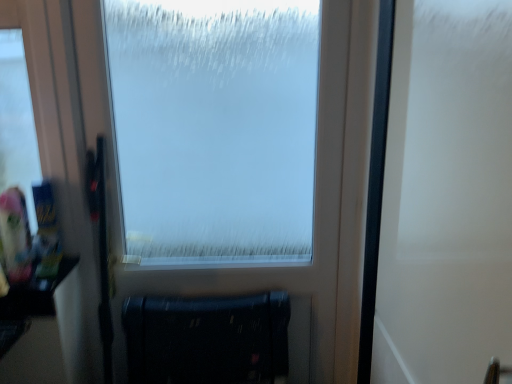
Question: Can you confirm if matte black radiator at lower center is taller than white matte screen door at right?

Choices:
 (A) yes
 (B) no

Answer: (B)

Question: Is matte black radiator at lower center completely or partially outside of white matte screen door at right?

Choices:
 (A) yes
 (B) no

Answer: (A)

Question: Considering the relative sizes of matte black radiator at lower center and white matte screen door at right in the image provided, is matte black radiator at lower center bigger than white matte screen door at right?

Choices:
 (A) no
 (B) yes

Answer: (A)

Question: Considering the relative sizes of matte black radiator at lower center and white matte screen door at right in the image provided, is matte black radiator at lower center smaller than white matte screen door at right?

Choices:
 (A) no
 (B) yes

Answer: (B)

Question: Is white matte screen door at right at the back of matte black radiator at lower center?

Choices:
 (A) no
 (B) yes

Answer: (A)

Question: From a real-world perspective, is white matte screen door at right above or below frosted glass window at center?

Choices:
 (A) below
 (B) above

Answer: (B)

Question: Is white matte screen door at right spatially inside frosted glass window at center, or outside of it?

Choices:
 (A) inside
 (B) outside

Answer: (B)

Question: Looking at their shapes, would you say white matte screen door at right is wider or thinner than frosted glass window at center?

Choices:
 (A) thin
 (B) wide

Answer: (B)

Question: Considering the positions of point (426, 29) and point (361, 97), is point (426, 29) closer or farther from the camera than point (361, 97)?

Choices:
 (A) farther
 (B) closer

Answer: (B)

Question: From their relative heights in the image, would you say matte black radiator at lower center is taller or shorter than frosted glass window at center?

Choices:
 (A) tall
 (B) short

Answer: (B)

Question: Looking at their shapes, would you say matte black radiator at lower center is wider or thinner than frosted glass window at center?

Choices:
 (A) wide
 (B) thin

Answer: (A)

Question: In terms of size, does matte black radiator at lower center appear bigger or smaller than frosted glass window at center?

Choices:
 (A) small
 (B) big

Answer: (A)

Question: From a real-world perspective, relative to frosted glass window at center, is matte black radiator at lower center vertically above or below?

Choices:
 (A) above
 (B) below

Answer: (B)

Question: From a real-world perspective, relative to white matte screen door at right, is frosted glass window at center vertically above or below?

Choices:
 (A) below
 (B) above

Answer: (A)

Question: Considering the positions of point (329, 129) and point (434, 104), is point (329, 129) closer or farther from the camera than point (434, 104)?

Choices:
 (A) closer
 (B) farther

Answer: (B)